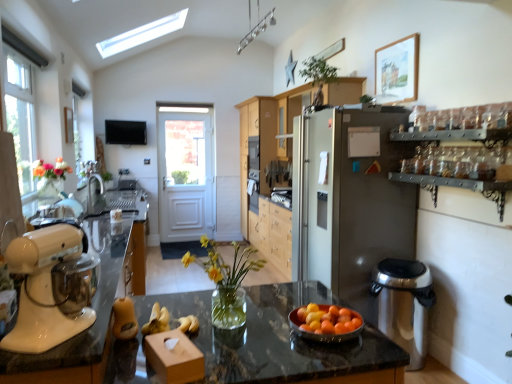
You are a GUI agent. You are given a task and a screenshot of the screen. Output one action in this format:
    pyautogui.click(x=<x>, y=<y>)
    Task: Click on the blank space above black granite countertop at center, positioned as the first countertop in right-to-left order (from a real-world perspective)
    The width and height of the screenshot is (512, 384).
    Given the screenshot: What is the action you would take?
    pyautogui.click(x=247, y=310)